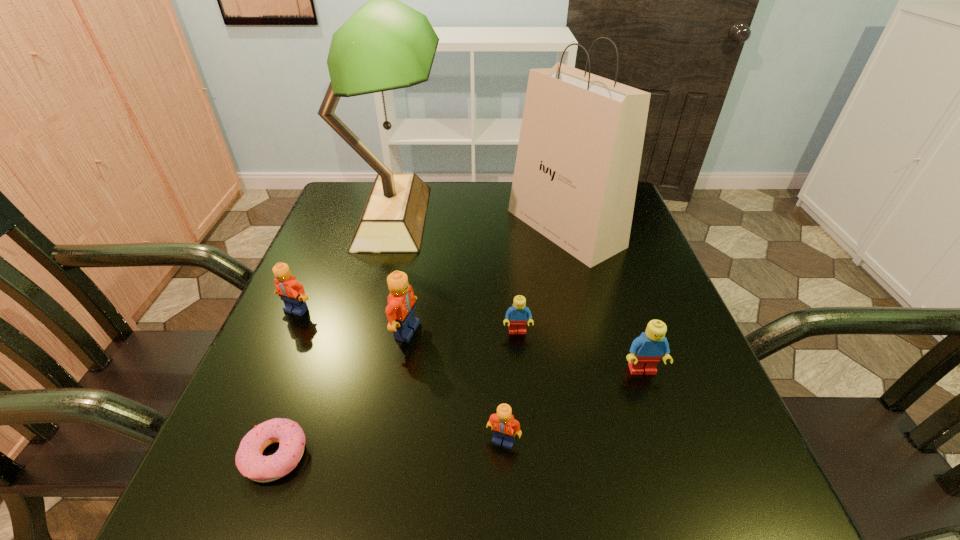
This screenshot has height=540, width=960. I want to click on the left blue Lego, so click(517, 315).

What are the coordinates of `the farther blue Lego` in the screenshot? It's located at (517, 315).

This screenshot has width=960, height=540. Identify the location of doughnut. (250, 462).

This screenshot has height=540, width=960. I want to click on pink doughnut, so click(x=250, y=462).

Where is `vacant region located on the metallic stand of the table lamp`? This screenshot has width=960, height=540. vacant region located on the metallic stand of the table lamp is located at coordinates (478, 218).

At what (x,y) coordinates should I click in order to perform the action: click on free region located on the left of the shopping bag. Please return your answer as a coordinate pair (x, y). The image size is (960, 540). Looking at the image, I should click on (463, 228).

Locate an element on the screen. Image resolution: width=960 pixels, height=540 pixels. vacant space positioned 0.400m on the front-facing side of the second orange Lego from left to right is located at coordinates (624, 331).

You are a GUI agent. You are given a task and a screenshot of the screen. Output one action in this format:
    pyautogui.click(x=<x>, y=<y>)
    Task: Click on the vacant space located 0.170m on the front-facing side of the second smallest orange Lego
    The image size is (960, 540).
    Given the screenshot: What is the action you would take?
    pyautogui.click(x=262, y=388)

Locate an element on the screen. This screenshot has width=960, height=540. vacant space located on the face of the right blue Lego is located at coordinates (692, 517).

This screenshot has height=540, width=960. In order to click on vacant region located on the front-facing side of the nearest orange Lego in this screenshot , I will do `click(507, 527)`.